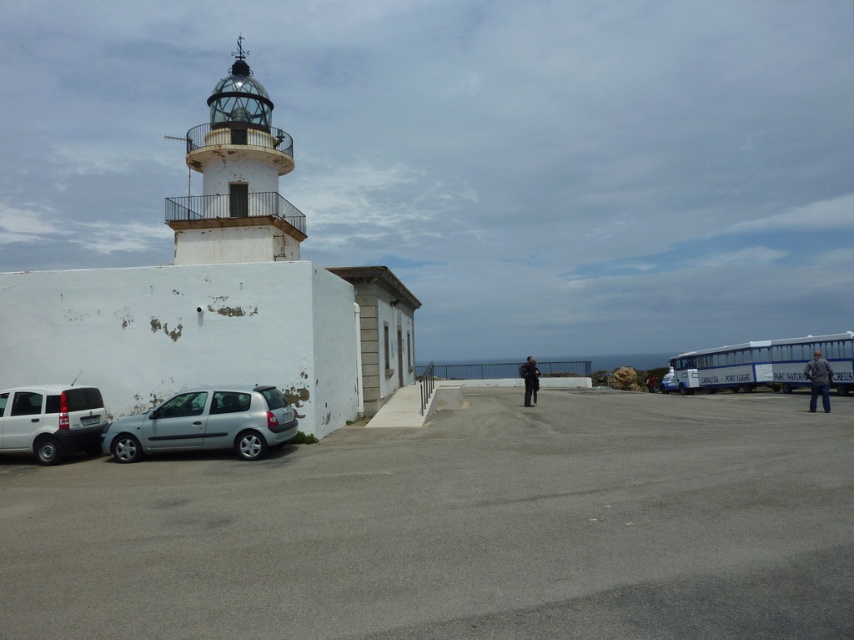
Question: Which of the following is the closest to the observer?

Choices:
 (A) (664, 388)
 (B) (6, 426)
 (C) (206, 522)
 (D) (521, 376)

Answer: (C)

Question: Which of the following is the farthest from the observer?

Choices:
 (A) blue denim jacket at lower right
 (B) silver metallic car at center

Answer: (B)

Question: Does blue denim jacket at lower right have a smaller size compared to black fabric jacket at center?

Choices:
 (A) yes
 (B) no

Answer: (A)

Question: Which point is farther to the camera?

Choices:
 (A) (653, 385)
 (B) (531, 378)
 (C) (823, 369)

Answer: (A)

Question: Where is white textured lighthouse at center-left located in relation to black fabric jacket at center in the image?

Choices:
 (A) left
 (B) right

Answer: (A)

Question: Can you confirm if satin silver hatchback at lower left is positioned below silver metallic car at center?

Choices:
 (A) no
 (B) yes

Answer: (A)